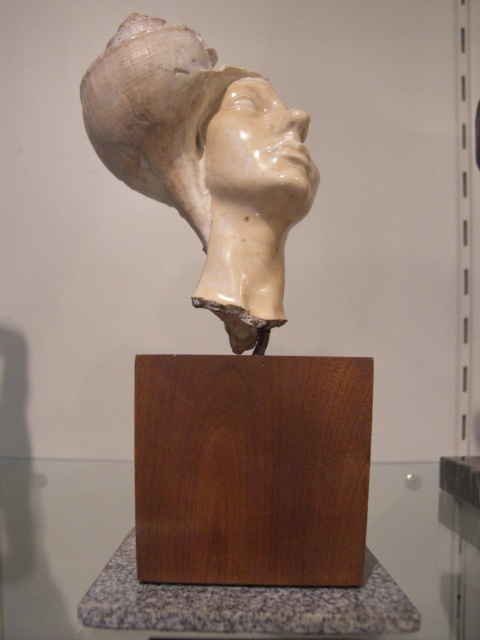
Question: Is white glossy sculpture at center to the left of matte white sculpture at center from the viewer's perspective?

Choices:
 (A) no
 (B) yes

Answer: (B)

Question: Which of these objects is positioned farthest from the matte white sculpture at center?

Choices:
 (A) dark brown wood at center
 (B) white glossy sculpture at center

Answer: (A)

Question: Does dark brown wood at center appear over white glossy sculpture at center?

Choices:
 (A) no
 (B) yes

Answer: (A)

Question: Does white porcelain sculpture at center appear on the left side of white glossy sculpture at center?

Choices:
 (A) no
 (B) yes

Answer: (B)

Question: Which point is closer to the camera?

Choices:
 (A) matte white sculpture at center
 (B) dark brown wood at center
 (C) white glossy sculpture at center

Answer: (B)

Question: Which point is closer to the camera?

Choices:
 (A) (299, 140)
 (B) (262, 381)
 (C) (148, 17)

Answer: (B)